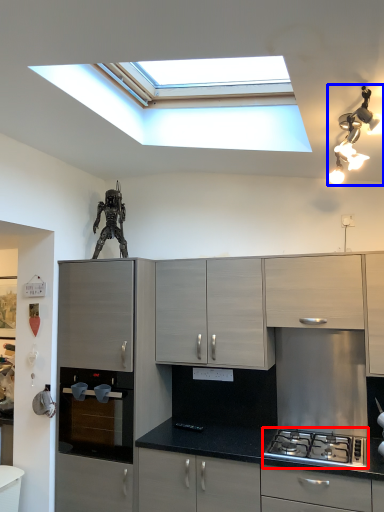
Question: Which object appears farthest to the camera in this image, gas stove (highlighted by a red box) or light fixture (highlighted by a blue box)?

Choices:
 (A) gas stove
 (B) light fixture

Answer: (A)